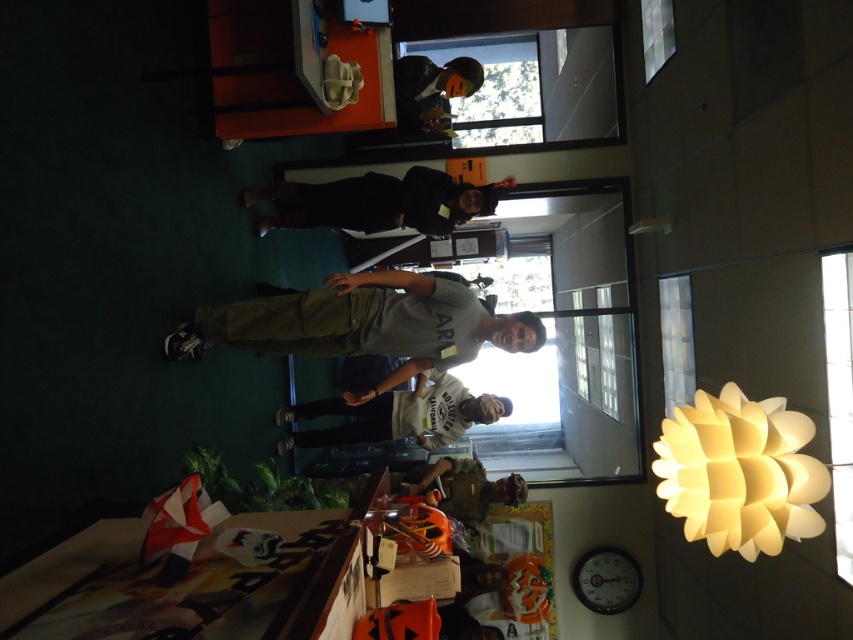
Which of these two, matte black jacket at upper center or camouflage fabric backpack at center, stands taller?

With more height is matte black jacket at upper center.

Who is positioned more to the left, matte black jacket at upper center or camouflage fabric backpack at center?

From the viewer's perspective, matte black jacket at upper center appears more on the left side.

Does point (405, 109) come closer to viewer compared to point (444, 472)?

That is False.

Locate an element on the screen. matte black jacket at upper center is located at coordinates 430,90.

Who is shorter, black matte jacket at center or matte black jacket at upper center?

Standing shorter between the two is black matte jacket at center.

Does black matte jacket at center appear on the right side of matte black jacket at upper center?

No, black matte jacket at center is not to the right of matte black jacket at upper center.

I want to click on black matte jacket at center, so click(376, 202).

Who is more forward, (766, 467) or (395, 214)?

Point (766, 467) is in front.

Between white matte lamp at upper right and black matte jacket at center, which one appears on the left side from the viewer's perspective?

From the viewer's perspective, black matte jacket at center appears more on the left side.

Identify the location of white matte lamp at upper right. (740, 472).

What are the coordinates of `white matte lamp at upper right` in the screenshot? It's located at (740, 472).